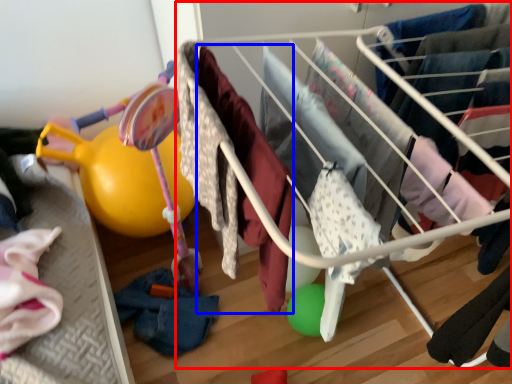
Question: Which object appears closest to the camera in this image, infant bed (highlighted by a red box) or clothing (highlighted by a blue box)?

Choices:
 (A) infant bed
 (B) clothing

Answer: (B)